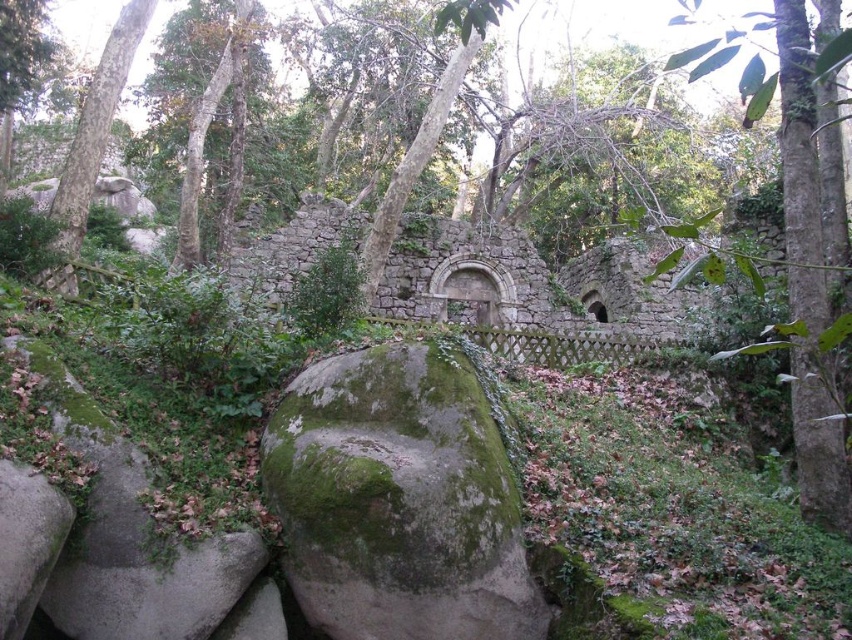
Can you confirm if green mossy rock at center is positioned above green mossy rock at left?

No, green mossy rock at center is not above green mossy rock at left.

Does green mossy rock at center have a greater width compared to green mossy rock at left?

No, green mossy rock at center is not wider than green mossy rock at left.

Locate an element on the screen. The width and height of the screenshot is (852, 640). green mossy rock at center is located at coordinates (398, 500).

You are a GUI agent. You are given a task and a screenshot of the screen. Output one action in this format:
    pyautogui.click(x=<x>, y=<y>)
    Task: Click on the green mossy rock at center
    
    Given the screenshot: What is the action you would take?
    pyautogui.click(x=398, y=500)